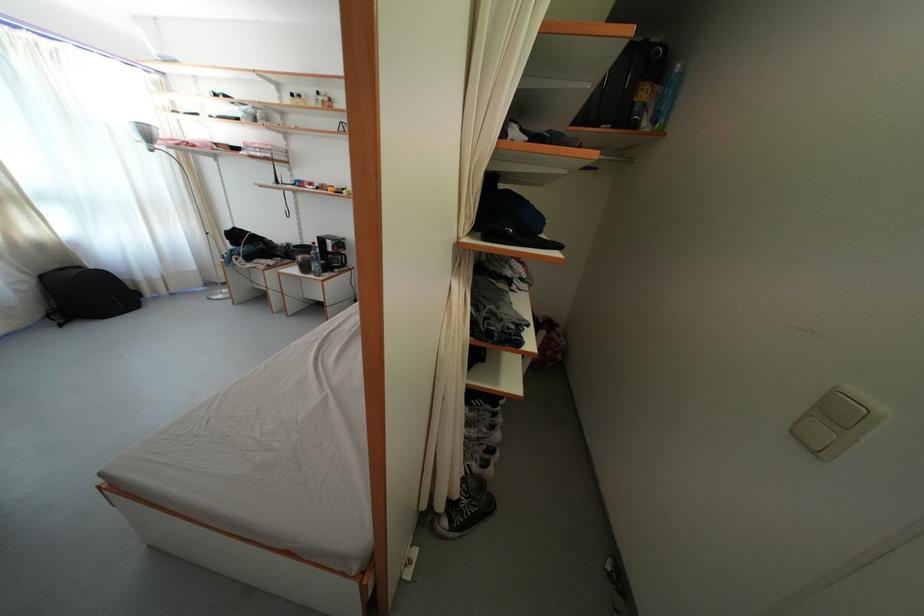
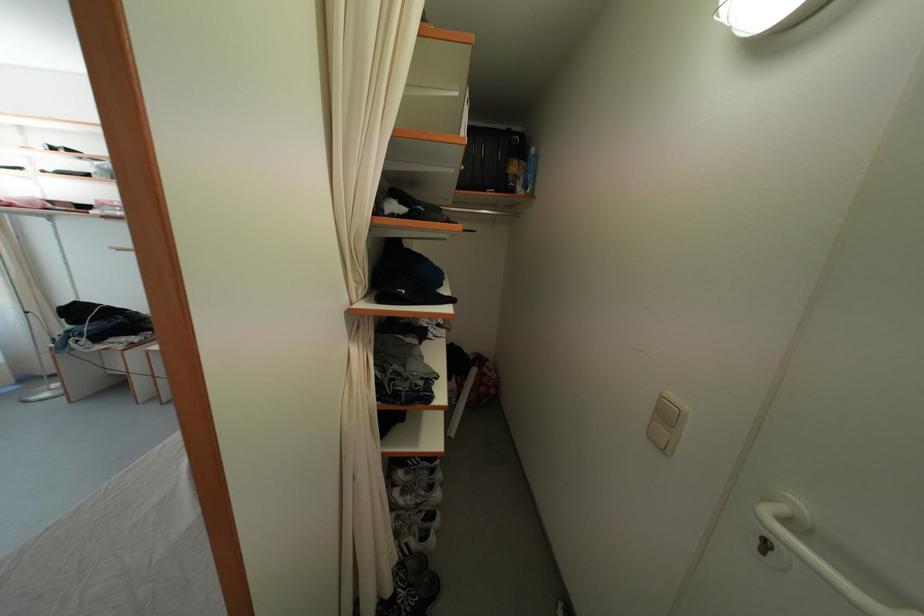
Find the pixel in the second image that matches pixel 650 129 in the first image.

(525, 195)